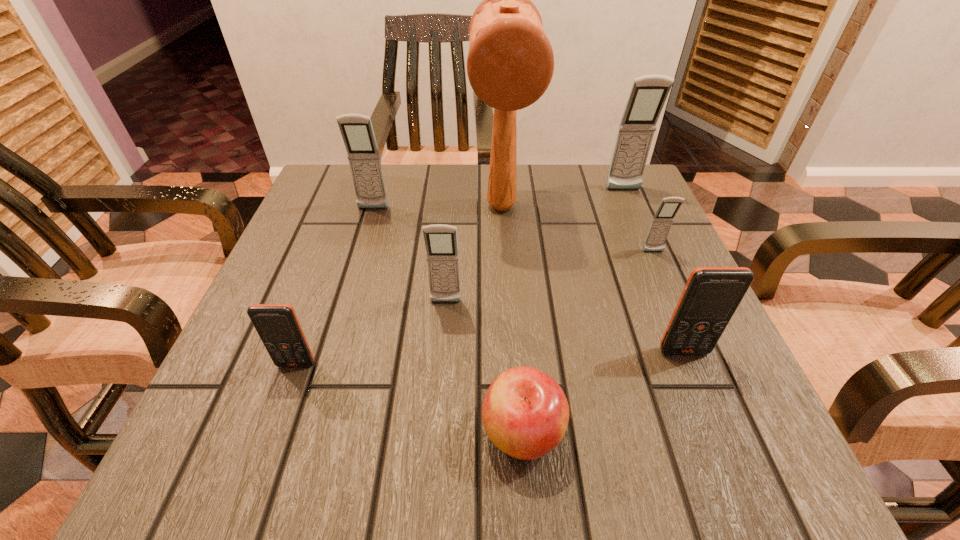
At what (x,y) coordinates should I click in order to perform the action: click on free spot between the tallest object and the apple. Please return your answer as a coordinate pair (x, y). This screenshot has height=540, width=960. Looking at the image, I should click on (512, 319).

Locate an element on the screen. empty space that is in between the second nearest object and the third object from left to right is located at coordinates pos(371,333).

Locate an element on the screen. Image resolution: width=960 pixels, height=540 pixels. free space that is in between the leftmost gray cellular telephone and the tallest object is located at coordinates (437, 208).

Locate which object is the second closest to the third nearest gray cellular telephone. Please provide its 2D coordinates. Your answer should be formatted as a tuple, i.e. [(x, y)], where the tuple contains the x and y coordinates of a point satisfying the conditions above.

[(441, 243)]

Locate an element on the screen. object that is the fifth closest one to the third object from left to right is located at coordinates (711, 296).

Identify which cellular telephone is the fourth nearest to the fourth cellular telephone from right to left. Please provide its 2D coordinates. Your answer should be formatted as a tuple, i.e. [(x, y)], where the tuple contains the x and y coordinates of a point satisfying the conditions above.

[(662, 221)]

The height and width of the screenshot is (540, 960). I want to click on cellular telephone that stands as the second closest to the farthest cellular telephone, so click(711, 296).

Identify which gray cellular telephone is located as the nearest to the tallest object. Please provide its 2D coordinates. Your answer should be formatted as a tuple, i.e. [(x, y)], where the tuple contains the x and y coordinates of a point satisfying the conditions above.

[(441, 243)]

Locate an element on the screen. Image resolution: width=960 pixels, height=540 pixels. the closest gray cellular telephone relative to the tallest object is located at coordinates (441, 243).

The image size is (960, 540). Find the location of `free spot that satisfies the following two spatial constraints: 1. on the front-facing side of the fourth farthest cellular telephone; 2. on the left side of the shortest object`. free spot that satisfies the following two spatial constraints: 1. on the front-facing side of the fourth farthest cellular telephone; 2. on the left side of the shortest object is located at coordinates (436, 432).